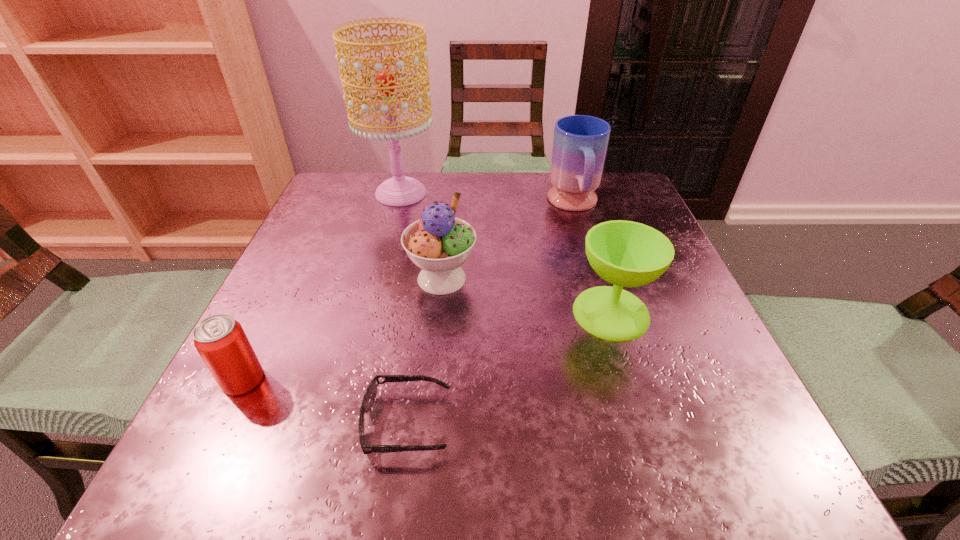
Image resolution: width=960 pixels, height=540 pixels. Find the location of `free space located 0.180m on the left of the wineglass`. free space located 0.180m on the left of the wineglass is located at coordinates (468, 313).

Find the location of a particular element. The width and height of the screenshot is (960, 540). vacant space located 0.120m on the back of the leftmost object is located at coordinates (278, 308).

Find the location of a particular element. This screenshot has width=960, height=540. blank space located on the front-facing side of the sunglasses is located at coordinates (487, 423).

I want to click on lampshade at the far edge, so click(400, 190).

This screenshot has height=540, width=960. Find the location of `mug that is at the far edge`. mug that is at the far edge is located at coordinates (580, 142).

At what (x,y) coordinates should I click in order to perform the action: click on object located in the near edge section of the desktop. Please return your answer as a coordinate pair (x, y). The image size is (960, 540). Looking at the image, I should click on (370, 395).

The image size is (960, 540). I want to click on lampshade that is at the left edge, so click(400, 190).

Where is `can that is positioned at the left edge`? This screenshot has width=960, height=540. can that is positioned at the left edge is located at coordinates (220, 340).

Locate an element on the screen. Image resolution: width=960 pixels, height=540 pixels. mug that is at the right edge is located at coordinates (580, 142).

In order to click on wineglass present at the right edge in this screenshot , I will do `click(624, 253)`.